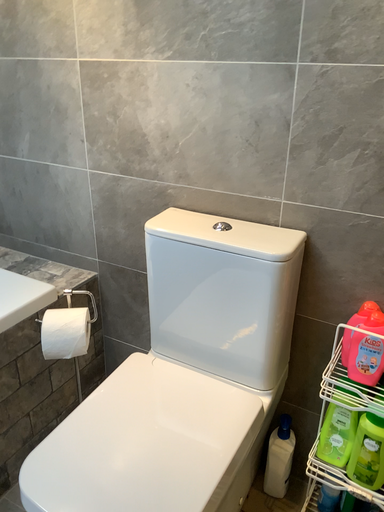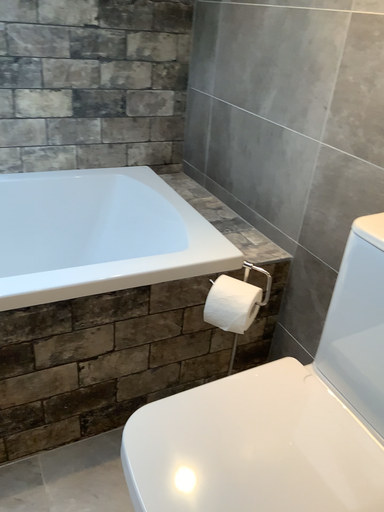
Question: Which way did the camera rotate in the video?

Choices:
 (A) rotated left
 (B) rotated right

Answer: (A)